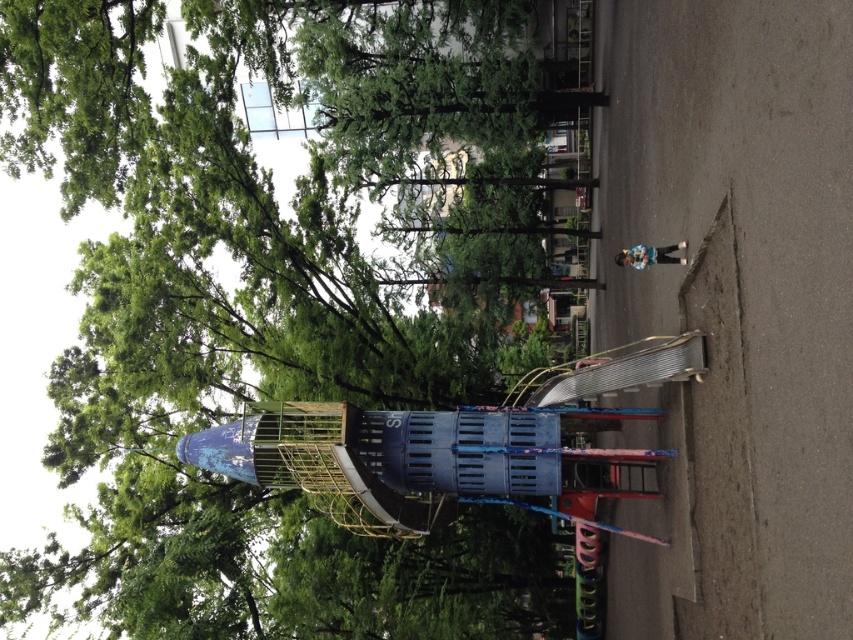
You are a parent supervising children at the playground. You notice a green matte tree at upper left and a metallic playground slide at center. Which object is closer to the ground?

The green matte tree at upper left is positioned under the metallic playground slide at center, so the green matte tree at upper left is closer to the ground.

Consider the image. You are standing at the entrance of the playground and see the green matte tree at upper left and the metallic playground slide at center. If you want to reach the slide, should you walk towards the left or right of the tree?

The green matte tree at upper left is to the left of the metallic playground slide at center. To reach the slide, you should walk to the right of the green matte tree at upper left.